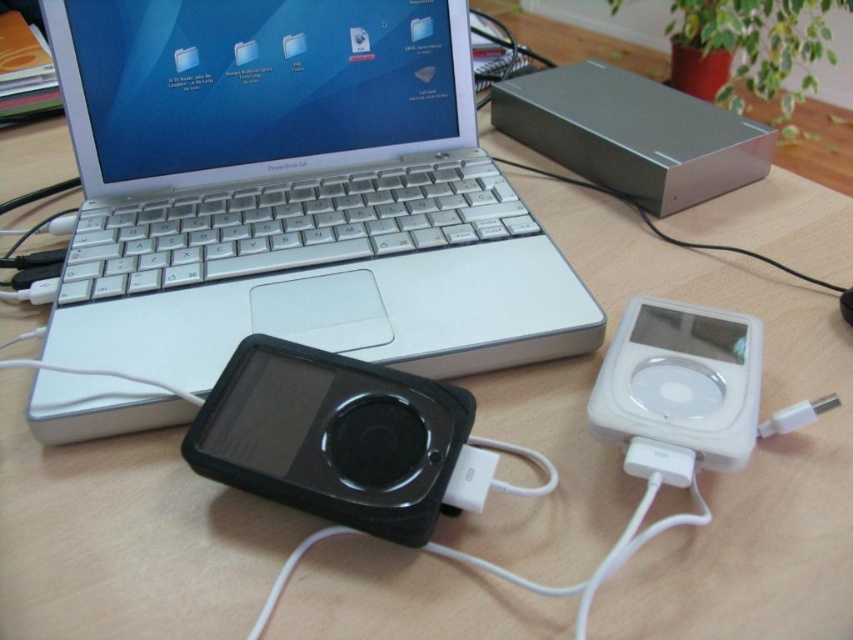
Question: Which object is positioned closest to the white glossy ipod at right?

Choices:
 (A) white plastic usb plug at center
 (B) black rubberized mp3 player at center

Answer: (A)

Question: Is silver metallic laptop at center to the left of white plastic usb plug at center from the viewer's perspective?

Choices:
 (A) no
 (B) yes

Answer: (B)

Question: Considering the relative positions of silver metallic laptop at center and white plastic usb plug at center in the image provided, where is silver metallic laptop at center located with respect to white plastic usb plug at center?

Choices:
 (A) left
 (B) right

Answer: (A)

Question: Does silver metallic laptop at center appear on the right side of black rubberized mp3 player at center?

Choices:
 (A) no
 (B) yes

Answer: (A)

Question: Among these points, which one is nearest to the camera?

Choices:
 (A) (483, 461)
 (B) (186, 76)
 (C) (668, 310)

Answer: (A)

Question: Estimate the real-world distances between objects in this image. Which object is farther from the black rubberized mp3 player at center?

Choices:
 (A) white glossy ipod at right
 (B) white plastic usb plug at center
 (C) silver metallic laptop at center

Answer: (C)